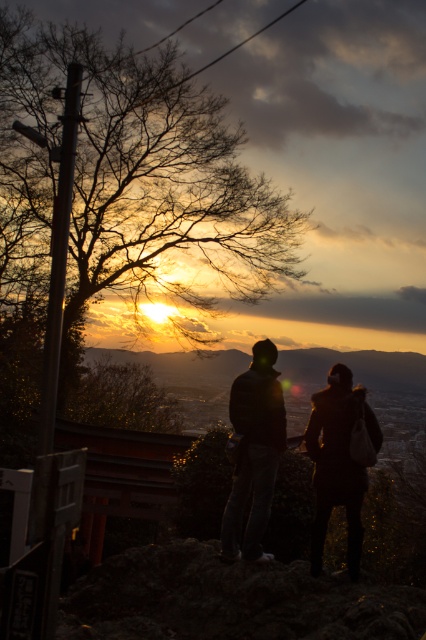
You are planning to take a photo of the two people in the sunset scene. The camera you are using has a focus range of 5 inches. Can you focus on both the dark brown leather jacket at center and the dark blue jeans at center at the same time?

The dark brown leather jacket at center is 5.52 inches away from the dark blue jeans at center. Since the camera can only focus within a 5 inches range, the distance between them exceeds the focus range. Therefore, you cannot focus on both the dark brown leather jacket at center and the dark blue jeans at center simultaneously.

You are planning to take a photo of the dark brown leather jacket at center and the dark blue jeans at center in the sunset scene. Which object is wider when captured in the photo?

The dark brown leather jacket at center is wider than the dark blue jeans at center in the photo.

You are a photographer trying to capture the sunset scene. You notice the dark brown leather jacket at center and the dark blue jeans at center. Which object should you focus on if you want to photograph the taller one?

The dark brown leather jacket at center is taller than the dark blue jeans at center, so you should focus on the dark brown leather jacket at center.